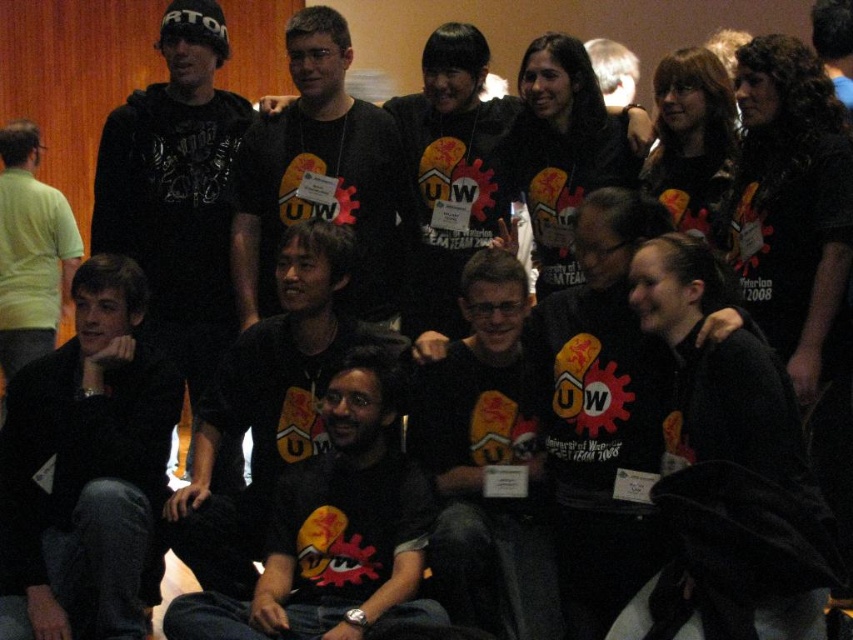
Question: Which object appears closest to the camera in this image?

Choices:
 (A) black matte shirt at lower left
 (B) black hoodie at left

Answer: (A)

Question: Is black matte shirt at lower left below black hoodie at left?

Choices:
 (A) yes
 (B) no

Answer: (A)

Question: Considering the real-world distances, which object is closest to the matte black t-shirt at center?

Choices:
 (A) black matte t-shirt at center
 (B) black matte shirt at lower left
 (C) black hoodie at left
 (D) light green shirt at left

Answer: (B)

Question: Estimate the real-world distances between objects in this image. Which object is closer to the black matte shirt at lower left?

Choices:
 (A) black matte jacket at lower right
 (B) black matte t-shirt at center
 (C) black hoodie at left

Answer: (C)

Question: In this image, where is black matte jacket at lower right located relative to light green shirt at left?

Choices:
 (A) left
 (B) right

Answer: (B)

Question: Considering the relative positions of black matte jacket at lower right and black matte t-shirt at center in the image provided, where is black matte jacket at lower right located with respect to black matte t-shirt at center?

Choices:
 (A) below
 (B) above

Answer: (A)